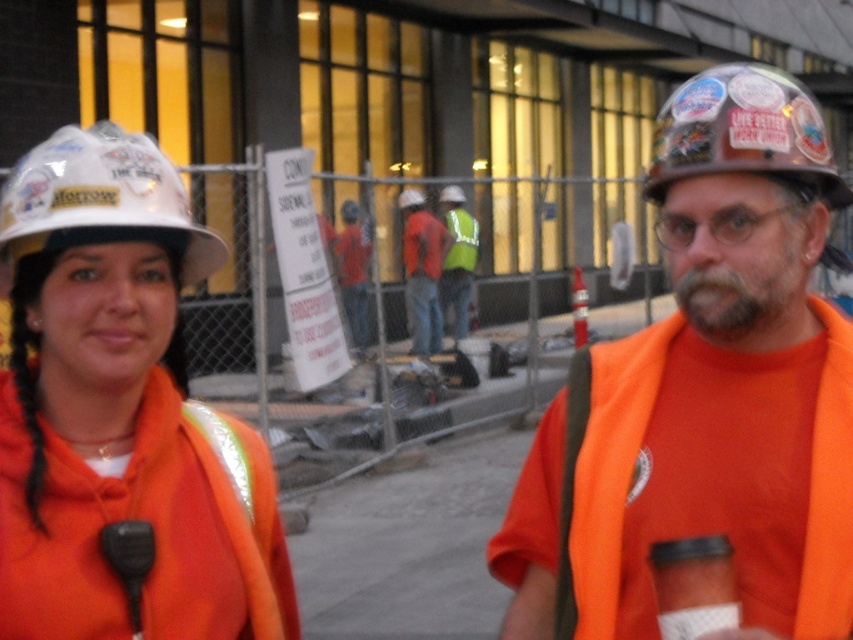
Question: Observing the image, what is the correct spatial positioning of white hard hat at upper left in reference to matte orange shirt at center?

Choices:
 (A) left
 (B) right

Answer: (A)

Question: Which of the following is the closest to the observer?

Choices:
 (A) orange fabric safety vest at right
 (B) red reflective vest at center
 (C) matte orange safety vest at center

Answer: (C)

Question: Is orange fabric safety vest at right behind white hard hat at upper left?

Choices:
 (A) yes
 (B) no

Answer: (A)

Question: Which object is positioned farthest from the matte orange safety vest at center?

Choices:
 (A) white hard hat at upper left
 (B) stickered brown hard hat at center
 (C) matte orange shirt at center

Answer: (C)

Question: Is orange fabric safety vest at right wider than red reflective vest at center?

Choices:
 (A) yes
 (B) no

Answer: (B)

Question: Estimate the real-world distances between objects in this image. Which object is closer to the stickered brown hard hat at center?

Choices:
 (A) matte orange safety vest at center
 (B) red reflective vest at center
 (C) white hard hat at upper left

Answer: (A)